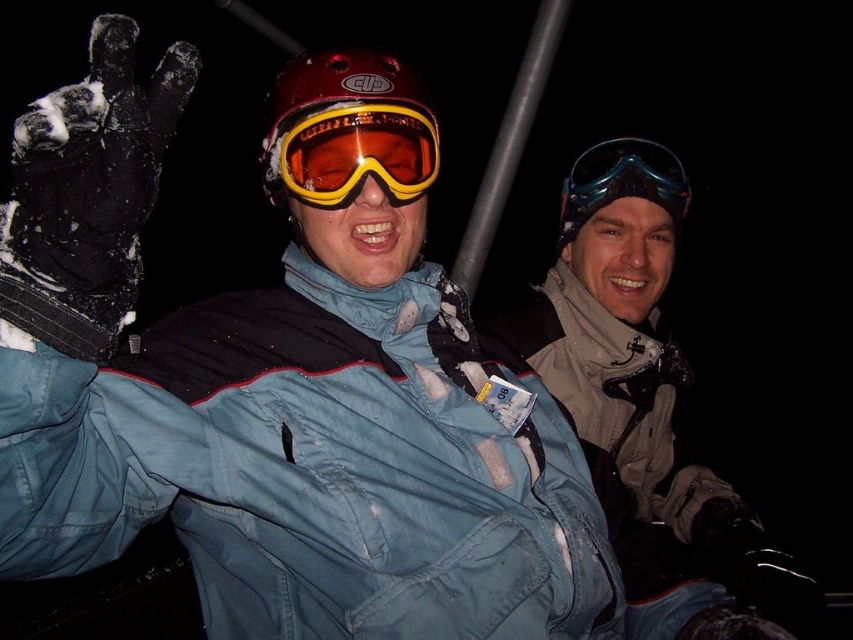
You are a photographer trying to capture a photo of both the matte gray jacket at center and the transparent blue goggles at upper center. Based on their positions, which object should you focus on first to ensure both are in the frame?

The matte gray jacket at center is below the transparent blue goggles at upper center, so you should focus on the transparent blue goggles at upper center first to ensure both are in the frame.

You are a photographer trying to capture both the matte gray jacket at center and the transparent blue goggles at upper center in a single shot. Which object should you focus on first to ensure both are in frame?

The matte gray jacket at center is taller than the transparent blue goggles at upper center, so focusing on the matte gray jacket at center first will ensure both are in frame.